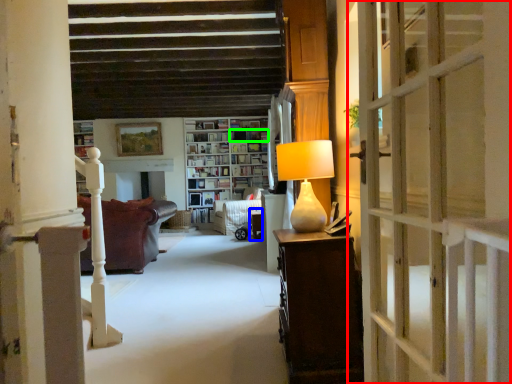
Question: Which is farther away from door (highlighted by a red box)? table (highlighted by a blue box) or book (highlighted by a green box)?

Choices:
 (A) table
 (B) book

Answer: (B)